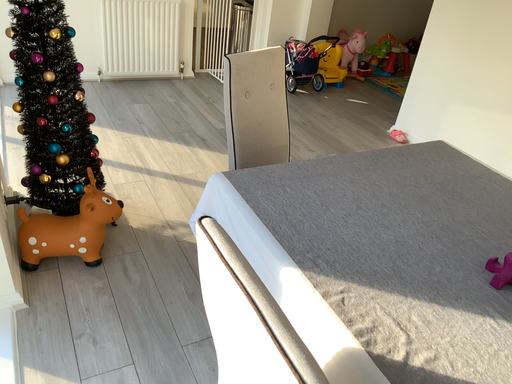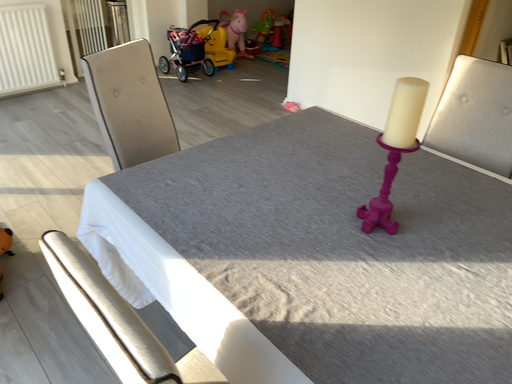
Question: How did the camera likely rotate when shooting the video?

Choices:
 (A) rotated right
 (B) rotated left

Answer: (A)